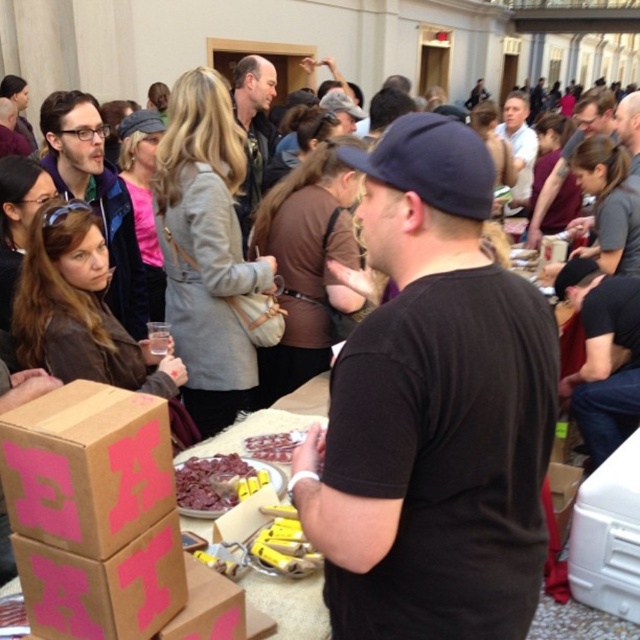
Question: Does matte gray jacket at center come behind shiny chocolate bar at center?

Choices:
 (A) no
 (B) yes

Answer: (B)

Question: Estimate the real-world distances between objects in this image. Which object is closer to the black matte shirt at center?

Choices:
 (A) brown cardboard box at lower left
 (B) white shirt at upper center

Answer: (A)

Question: Which of these objects is positioned farthest from the matte black jacket at upper left?

Choices:
 (A) shiny chocolate bar at center
 (B) white shirt at upper center
 (C) yellow plastic bananas at center
 (D) dark brown textured meat at center

Answer: (C)

Question: Can you confirm if yellow plastic bananas at center is smaller than white shirt at upper center?

Choices:
 (A) no
 (B) yes

Answer: (B)

Question: Based on their relative distances, which object is farther from the white shirt at upper center?

Choices:
 (A) matte black jacket at left
 (B) shiny chocolate bar at center
 (C) black matte shirt at center

Answer: (C)

Question: Is matte gray jacket at center bigger than matte black shirt at center?

Choices:
 (A) yes
 (B) no

Answer: (B)